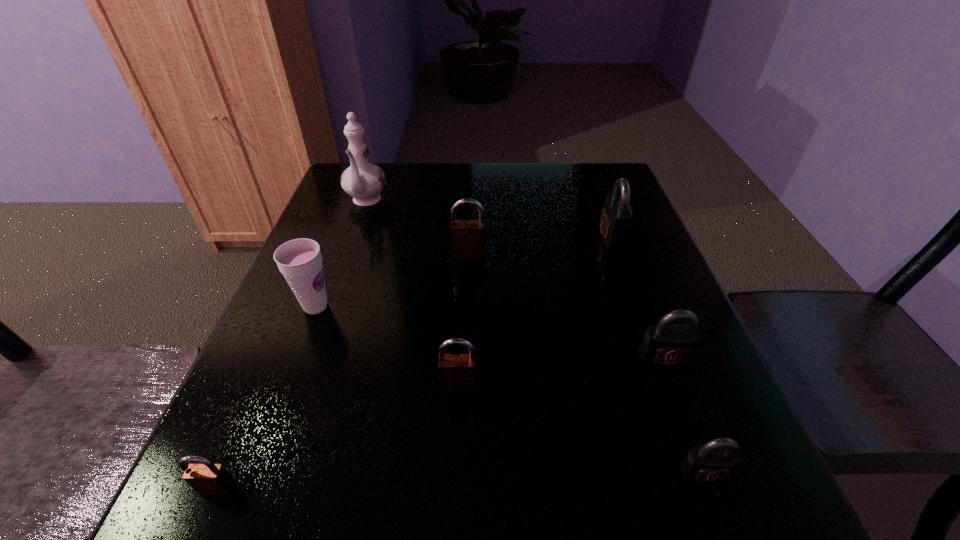
At what (x,y) coordinates should I click in order to perform the action: click on empty location between the third farthest padlock and the fourth farthest object. Please return your answer as a coordinate pair (x, y). This screenshot has width=960, height=540. Looking at the image, I should click on (490, 332).

Where is `free point between the third nearest object and the farthest padlock`? The width and height of the screenshot is (960, 540). free point between the third nearest object and the farthest padlock is located at coordinates (535, 310).

The image size is (960, 540). In order to click on free point between the smallest gray padlock and the second biggest gray padlock in this screenshot , I will do `click(684, 415)`.

Find the location of `unoccupied position between the second farthest gray padlock and the leftmost padlock`. unoccupied position between the second farthest gray padlock and the leftmost padlock is located at coordinates (441, 423).

What are the coordinates of `unoccupied area between the second farthest gray padlock and the second biggest brown padlock` in the screenshot? It's located at (562, 372).

Locate an element on the screen. The height and width of the screenshot is (540, 960). free space between the second nearest brown padlock and the cup is located at coordinates (387, 346).

The height and width of the screenshot is (540, 960). I want to click on object that stands as the third closest to the fifth nearest object, so click(x=364, y=181).

Locate an element on the screen. This screenshot has height=540, width=960. the fifth closest object to the farthest gray padlock is located at coordinates (364, 181).

You are a GUI agent. You are given a task and a screenshot of the screen. Output one action in this format:
    pyautogui.click(x=<x>, y=<y>)
    Task: Click on the padlock that is the second closest one to the leftmost brown padlock
    The width and height of the screenshot is (960, 540).
    Given the screenshot: What is the action you would take?
    pyautogui.click(x=467, y=236)

Identify the location of padlock that stands as the second closest to the third farthest object. (457, 372).